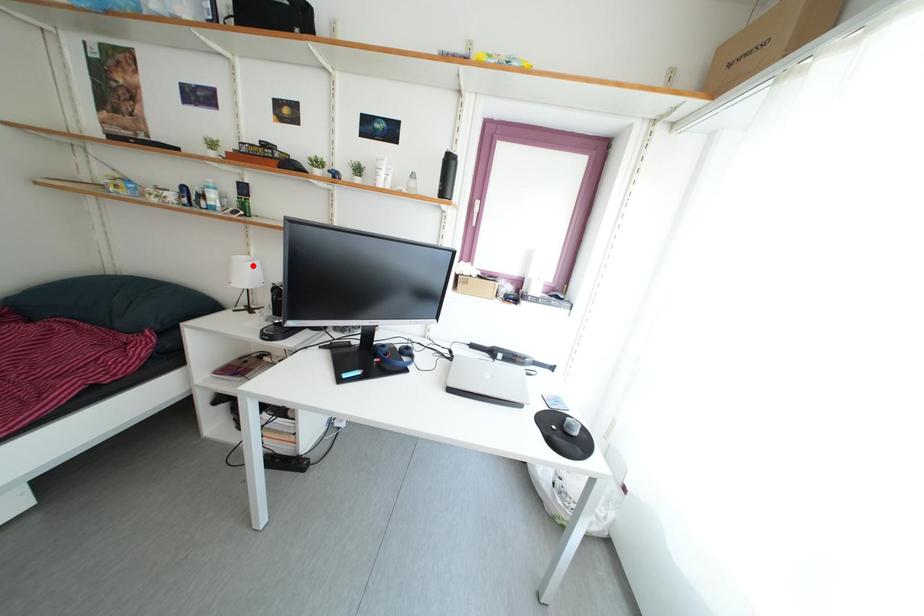
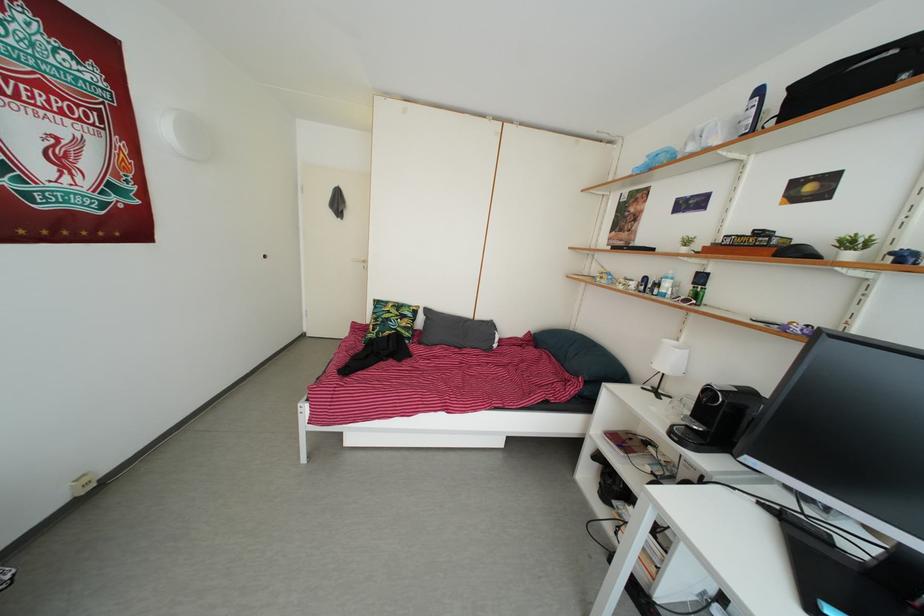
The point at the highlighted location is marked in the first image. Where is the corresponding point in the second image?

(681, 351)